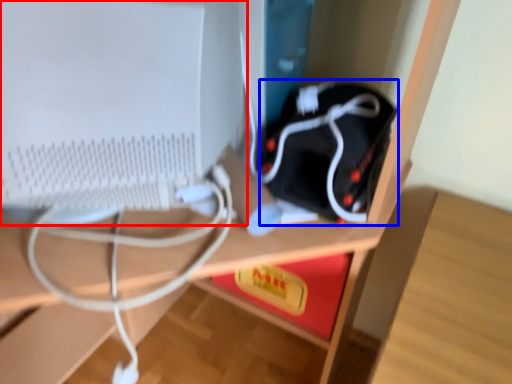
Question: Among these objects, which one is nearest to the camera, computer monitor (highlighted by a red box) or equipment (highlighted by a blue box)?

Choices:
 (A) computer monitor
 (B) equipment

Answer: (A)